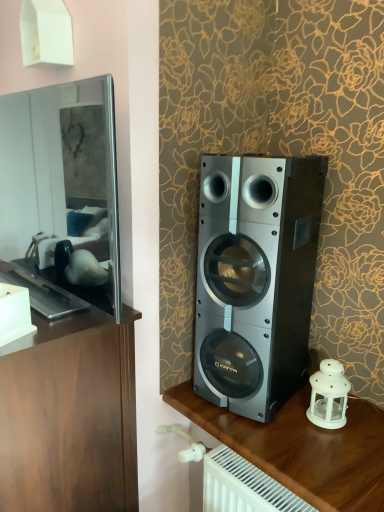
Question: From the image's perspective, is wooden cabinet at left, the 1th furniture viewed from the left, above silver metallic speaker at center?

Choices:
 (A) yes
 (B) no

Answer: (B)

Question: Is wooden cabinet at left, the 1th furniture viewed from the left, closer to the viewer compared to silver metallic speaker at center?

Choices:
 (A) no
 (B) yes

Answer: (B)

Question: From the image's perspective, is wooden cabinet at left, the 1th furniture viewed from the left, beneath silver metallic speaker at center?

Choices:
 (A) no
 (B) yes

Answer: (B)

Question: Considering the relative sizes of wooden cabinet at left, placed as the 2th furniture when sorted from right to left, and silver metallic speaker at center in the image provided, is wooden cabinet at left, placed as the 2th furniture when sorted from right to left, smaller than silver metallic speaker at center?

Choices:
 (A) yes
 (B) no

Answer: (B)

Question: Is wooden cabinet at left, the 1th furniture viewed from the left, outside of silver metallic speaker at center?

Choices:
 (A) yes
 (B) no

Answer: (A)

Question: From a real-world perspective, is silver metallic speaker at center positioned above or below white matte lantern at lower right?

Choices:
 (A) above
 (B) below

Answer: (A)

Question: Is silver metallic speaker at center wider or thinner than white matte lantern at lower right?

Choices:
 (A) thin
 (B) wide

Answer: (B)

Question: Does point (208, 276) appear closer or farther from the camera than point (322, 418)?

Choices:
 (A) closer
 (B) farther

Answer: (B)

Question: From the image's perspective, is silver metallic speaker at center above or below white matte lantern at lower right?

Choices:
 (A) above
 (B) below

Answer: (A)

Question: Is wooden cabinet at left, the 1th furniture viewed from the left, in front of or behind silver metallic speaker at center in the image?

Choices:
 (A) front
 (B) behind

Answer: (A)

Question: From the image's perspective, is wooden cabinet at left, placed as the 2th furniture when sorted from right to left, located above or below silver metallic speaker at center?

Choices:
 (A) above
 (B) below

Answer: (B)

Question: Is wooden cabinet at left, placed as the 2th furniture when sorted from right to left, inside the boundaries of silver metallic speaker at center, or outside?

Choices:
 (A) inside
 (B) outside

Answer: (B)

Question: In terms of width, does wooden cabinet at left, placed as the 2th furniture when sorted from right to left, look wider or thinner when compared to silver metallic speaker at center?

Choices:
 (A) wide
 (B) thin

Answer: (A)

Question: Is white matte lantern at lower right inside or outside of wooden cabinet at left, placed as the 2th furniture when sorted from right to left?

Choices:
 (A) outside
 (B) inside

Answer: (A)

Question: Considering the relative positions of white matte lantern at lower right and wooden cabinet at left, the 1th furniture viewed from the left, in the image provided, is white matte lantern at lower right to the left or to the right of wooden cabinet at left, the 1th furniture viewed from the left,?

Choices:
 (A) left
 (B) right

Answer: (B)